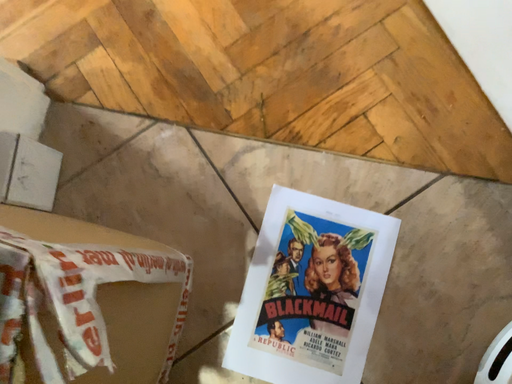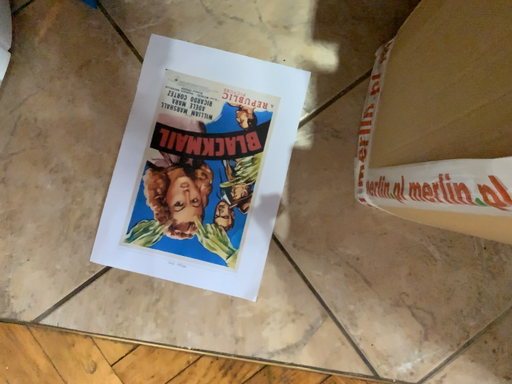
Question: Which way did the camera rotate in the video?

Choices:
 (A) rotated downward
 (B) rotated upward

Answer: (B)